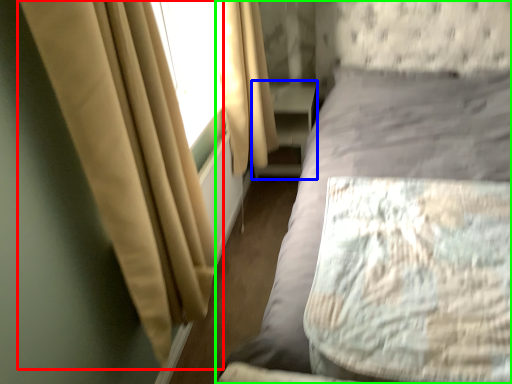
Question: Considering the real-world distances, which object is farthest from curtain (highlighted by a red box)? dresser (highlighted by a blue box) or bed (highlighted by a green box)?

Choices:
 (A) dresser
 (B) bed

Answer: (A)